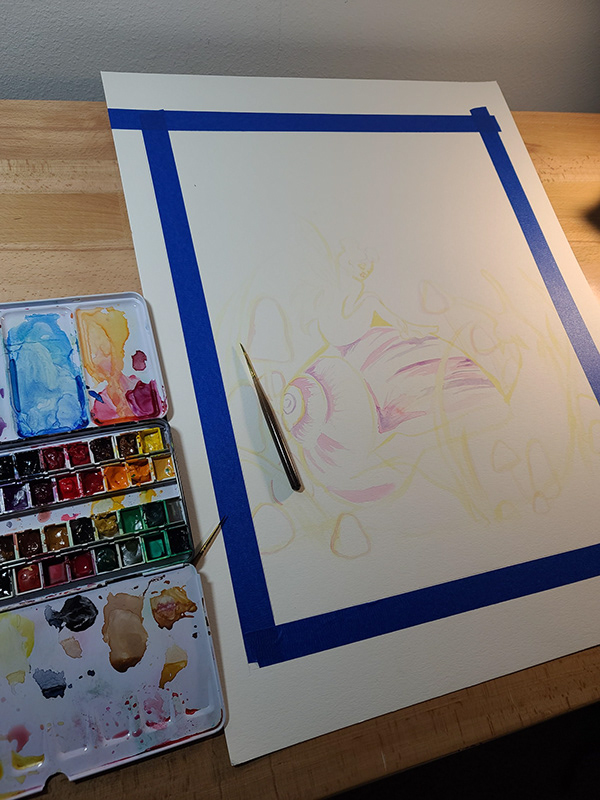
You are a GUI agent. You are given a task and a screenshot of the screen. Output one action in this format:
    pyautogui.click(x=<x>, y=<y>)
    Task: Click on the blue painters tape
    This screenshot has height=800, width=600.
    Given the screenshot: What is the action you would take?
    pyautogui.click(x=317, y=122), pyautogui.click(x=234, y=509), pyautogui.click(x=474, y=586), pyautogui.click(x=523, y=202)